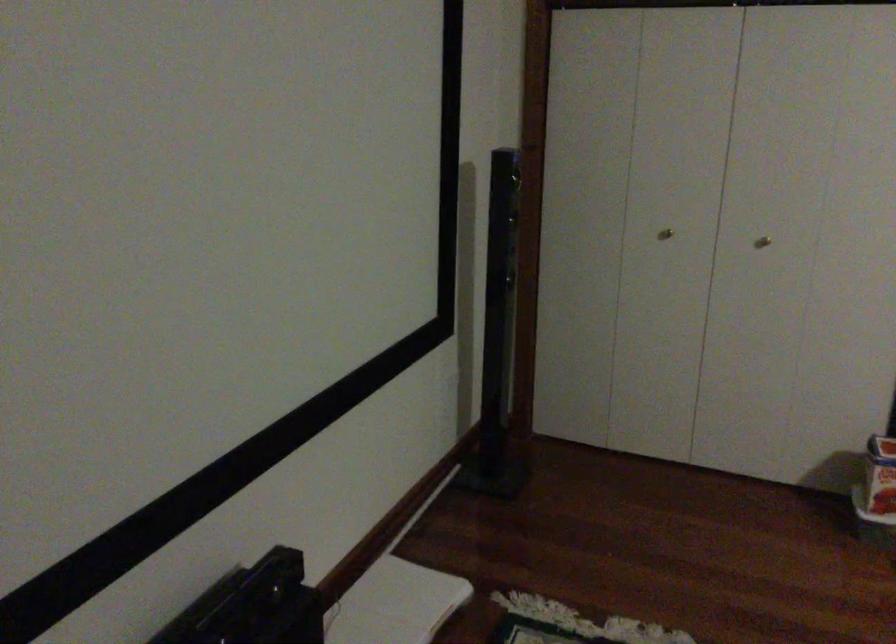
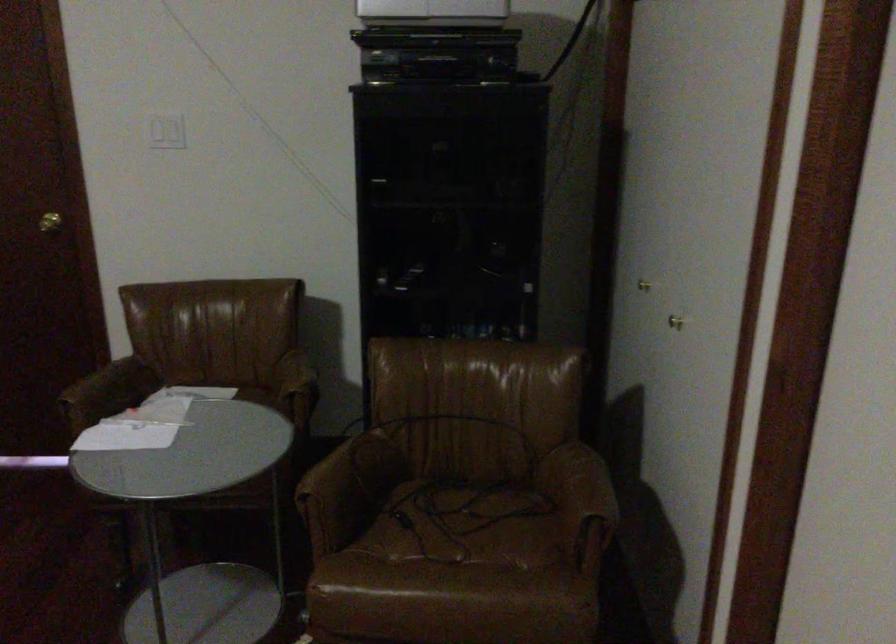
How did the camera likely rotate?

The rotation direction of the camera is right-down.